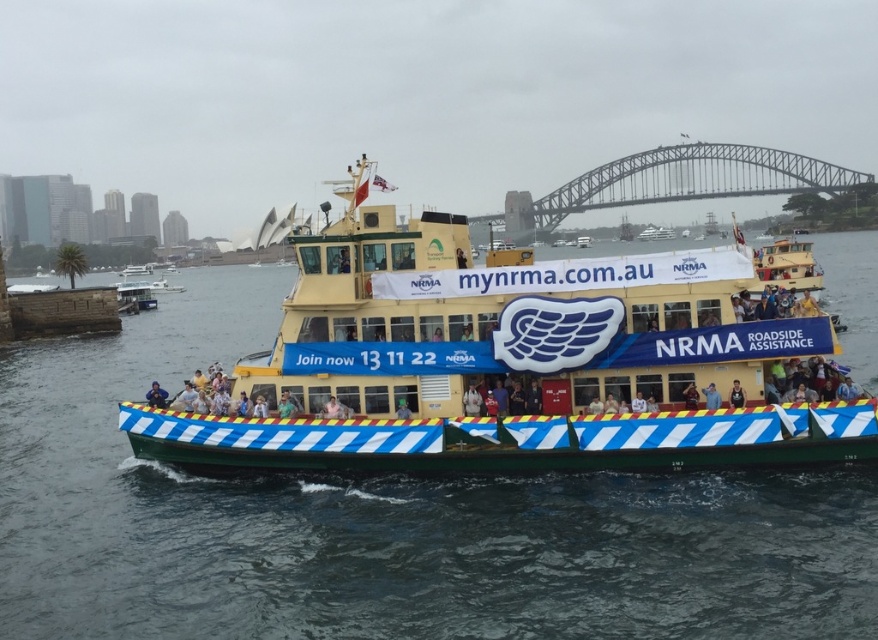
Is point (718, 397) positioned in front of point (131, 273)?

Yes, point (718, 397) is in front of point (131, 273).

Does blue fabric at center have a lesser width compared to blue and white striped ferry at center?

Yes.

The image size is (878, 640). Describe the element at coordinates (711, 396) in the screenshot. I see `blue fabric at center` at that location.

The width and height of the screenshot is (878, 640). What are the coordinates of `blue fabric at center` in the screenshot? It's located at (711, 396).

Is metallic steel bridge at upper center behind yellow painted ferry at center?

That is True.

Can you confirm if metallic steel bridge at upper center is bigger than yellow painted ferry at center?

Indeed, metallic steel bridge at upper center has a larger size compared to yellow painted ferry at center.

Who is more forward, (535, 202) or (180, 289)?

Point (180, 289) is in front.

Where is `metallic steel bridge at upper center`? This screenshot has height=640, width=878. metallic steel bridge at upper center is located at coordinates (686, 179).

I want to click on blue fabric jacket at lower left, so click(156, 396).

Which is more to the left, blue fabric jacket at lower left or dark blue fabric at center?

blue fabric jacket at lower left

I want to click on blue fabric jacket at lower left, so click(x=156, y=396).